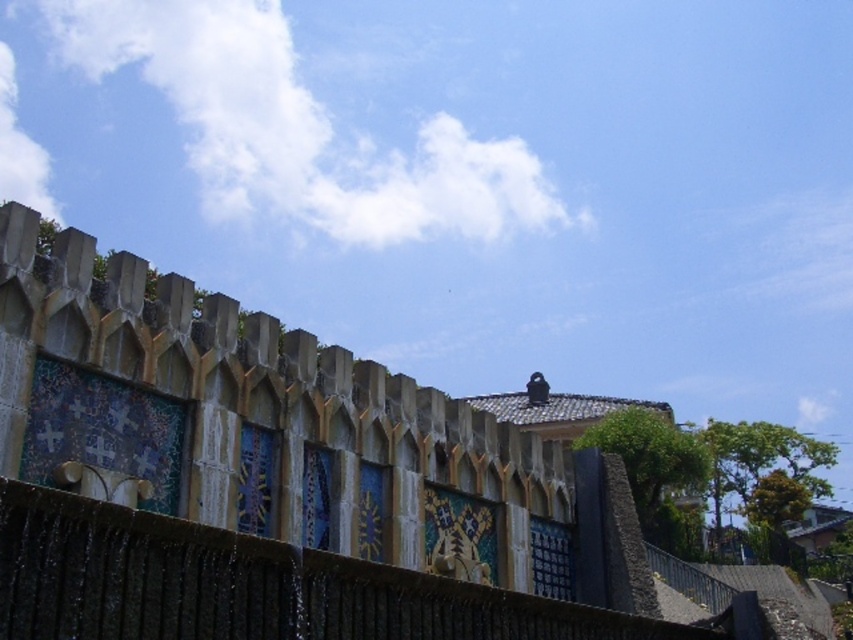
From the picture: You are standing in front of a building with a unique roof design. You notice a specific point marked at coordinates point (576, 612). Considering the building has a fortified appearance with arches and a colorful mosaic below, can you determine if this point is within a safe distance for a drone to hover without getting too close to the structure?

The point (576, 612) is 33.78 meters away from the camera, which is a safe distance for a drone to hover without getting too close to the structure.